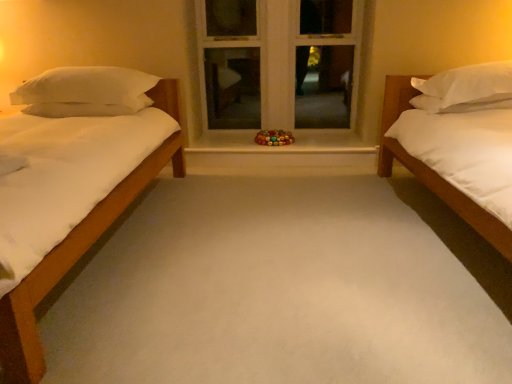
What are the coordinates of `white soft pillow at right, arranged as the second pillow when viewed from the left` in the screenshot? It's located at (467, 88).

Describe the element at coordinates (456, 142) in the screenshot. The image size is (512, 384). I see `white matte bed at right` at that location.

Where is `white soft pillow at left, which ranks as the 2th pillow in right-to-left order`? The height and width of the screenshot is (384, 512). white soft pillow at left, which ranks as the 2th pillow in right-to-left order is located at coordinates (85, 86).

From the image's perspective, does white marble window sill at center appear higher than white painted wood at center?

No, from the image's perspective, white marble window sill at center is not on top of white painted wood at center.

From a real-world perspective, who is located higher, white marble window sill at center or white painted wood at center?

In real-world perspective, white painted wood at center is above.

Does white marble window sill at center have a smaller size compared to white painted wood at center?

Yes, white marble window sill at center is smaller than white painted wood at center.

Is white painted wood at center to the left of white matte bed at right from the viewer's perspective?

Indeed, white painted wood at center is positioned on the left side of white matte bed at right.

Which of these two, white painted wood at center or white matte bed at right, stands shorter?

Standing shorter between the two is white matte bed at right.

Based on the photo, does white painted wood at center turn towards white matte bed at right?

Yes.

Which object is closer to the camera, white painted wood at center or white matte bed at right?

white matte bed at right is closer to the camera.

This screenshot has width=512, height=384. I want to click on window frame behind the white soft pillow at left, arranged as the 1th pillow when viewed from the left, so click(277, 61).

From the image's perspective, which is above, white painted wood at center or white soft pillow at left, arranged as the 1th pillow when viewed from the left?

white painted wood at center.

Can you see white painted wood at center touching white soft pillow at left, arranged as the 1th pillow when viewed from the left?

They are not placed beside each other.

Can you confirm if white painted wood at center is positioned to the left of white soft pillow at left, arranged as the 1th pillow when viewed from the left?

In fact, white painted wood at center is to the right of white soft pillow at left, arranged as the 1th pillow when viewed from the left.

How far apart are white soft pillow at left, arranged as the 1th pillow when viewed from the left, and white matte bed at right?

The distance of white soft pillow at left, arranged as the 1th pillow when viewed from the left, from white matte bed at right is 1.87 meters.

Considering the positions of points (117, 80) and (504, 238), is point (117, 80) farther from camera compared to point (504, 238)?

Yes, point (117, 80) is behind point (504, 238).

From the image's perspective, between white soft pillow at left, arranged as the 1th pillow when viewed from the left, and white matte bed at right, who is located below?

white matte bed at right.

From a real-world perspective, is white soft pillow at left, arranged as the 1th pillow when viewed from the left, physically above white matte bed at right?

Yes, from a real-world perspective, white soft pillow at left, arranged as the 1th pillow when viewed from the left, is above white matte bed at right.

Does point (468, 140) come behind point (92, 100)?

No.

Which of these two, white matte bed at right or white soft pillow at left, arranged as the 1th pillow when viewed from the left, is thinner?

With smaller width is white soft pillow at left, arranged as the 1th pillow when viewed from the left.

Between white matte bed at right and white soft pillow at left, which ranks as the 2th pillow in right-to-left order, which one has larger size?

With larger size is white matte bed at right.

From the image's perspective, is white matte bed at right positioned above or below white soft pillow at left, which ranks as the 2th pillow in right-to-left order?

From the image's perspective, white matte bed at right appears below white soft pillow at left, which ranks as the 2th pillow in right-to-left order.

Which point is more forward, [250,50] or [467,99]?

Positioned in front is point [467,99].

Is white painted wood at center behind white soft pillow at right, the first pillow from the right?

That is True.

Between white painted wood at center and white soft pillow at right, the first pillow from the right, which one appears on the left side from the viewer's perspective?

white painted wood at center is more to the left.

What are the coordinates of `window frame above the white soft pillow at right, arranged as the second pillow when viewed from the left (from the image's perspective)` in the screenshot? It's located at (277, 61).

From the image's perspective, is white soft pillow at left, arranged as the 1th pillow when viewed from the left, on top of white soft pillow at right, the first pillow from the right?

Indeed, from the image's perspective, white soft pillow at left, arranged as the 1th pillow when viewed from the left, is shown above white soft pillow at right, the first pillow from the right.

Is white soft pillow at left, arranged as the 1th pillow when viewed from the left, far away from white soft pillow at right, arranged as the second pillow when viewed from the left?

white soft pillow at left, arranged as the 1th pillow when viewed from the left, is positioned a significant distance from white soft pillow at right, arranged as the second pillow when viewed from the left.

Considering their positions, is white soft pillow at left, which ranks as the 2th pillow in right-to-left order, located in front of or behind white soft pillow at right, the first pillow from the right?

Clearly, white soft pillow at left, which ranks as the 2th pillow in right-to-left order, is behind white soft pillow at right, the first pillow from the right.

From a real-world perspective, is white soft pillow at left, arranged as the 1th pillow when viewed from the left, above or below white soft pillow at right, the first pillow from the right?

From a real-world perspective, white soft pillow at left, arranged as the 1th pillow when viewed from the left, is physically above white soft pillow at right, the first pillow from the right.

Image resolution: width=512 pixels, height=384 pixels. I want to click on window frame that is on the right side of white marble window sill at center, so click(x=277, y=61).

Find the location of a particular element. The image size is (512, 384). window frame lying behind the white matte bed at right is located at coordinates (277, 61).

Considering their positions, is white matte bed at right positioned closer to white soft pillow at right, arranged as the second pillow when viewed from the left, than white marble window sill at center?

Among the two, white matte bed at right is located nearer to white soft pillow at right, arranged as the second pillow when viewed from the left.

Consider the image. From the image, which object appears to be nearer to white matte bed at right, white painted wood at center or white soft pillow at right, the first pillow from the right?

white soft pillow at right, the first pillow from the right, is closer to white matte bed at right.

When comparing their distances from white soft pillow at left, which ranks as the 2th pillow in right-to-left order, does white painted wood at center or white matte bed at right seem closer?

white painted wood at center.

Considering their positions, is white marble window sill at center positioned closer to white painted wood at center than white matte bed at right?

white marble window sill at center.

Based on their spatial positions, is white painted wood at center or white matte bed at right further from white marble window sill at center?

white matte bed at right.

Looking at the image, which one is located closer to white soft pillow at right, arranged as the second pillow when viewed from the left, white marble window sill at center or white painted wood at center?

white marble window sill at center is closer to white soft pillow at right, arranged as the second pillow when viewed from the left.

When comparing their distances from white matte bed at right, does white soft pillow at left, which ranks as the 2th pillow in right-to-left order, or white soft pillow at right, arranged as the second pillow when viewed from the left, seem closer?

white soft pillow at right, arranged as the second pillow when viewed from the left, is positioned closer to the anchor white matte bed at right.

Considering their positions, is white soft pillow at right, the first pillow from the right, positioned further to white matte bed at right than white soft pillow at left, arranged as the 1th pillow when viewed from the left?

Based on the image, white soft pillow at left, arranged as the 1th pillow when viewed from the left, appears to be further to white matte bed at right.

This screenshot has width=512, height=384. I want to click on window sill between white soft pillow at left, which ranks as the 2th pillow in right-to-left order, and white painted wood at center, in the horizontal direction, so click(x=282, y=146).

Locate an element on the screen. window sill between white soft pillow at left, arranged as the 1th pillow when viewed from the left, and white soft pillow at right, the first pillow from the right is located at coordinates pyautogui.click(x=282, y=146).

I want to click on window sill located between white matte bed at right and white painted wood at center in the depth direction, so click(282, 146).

I want to click on window frame between white soft pillow at left, arranged as the 1th pillow when viewed from the left, and white soft pillow at right, arranged as the second pillow when viewed from the left, so click(277, 61).